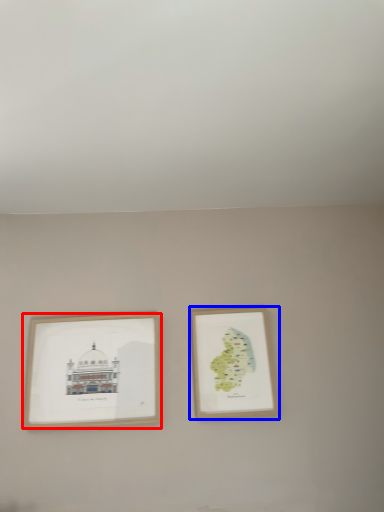
Question: Among these objects, which one is nearest to the camera, picture frame (highlighted by a red box) or picture frame (highlighted by a blue box)?

Choices:
 (A) picture frame
 (B) picture frame

Answer: (A)